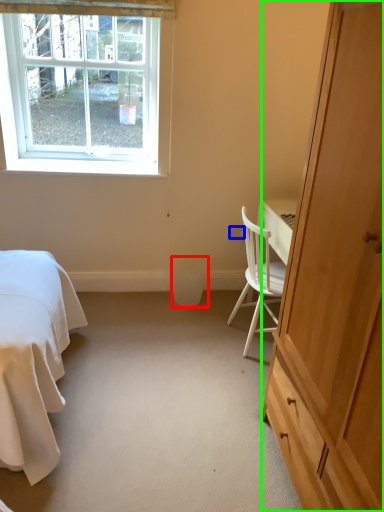
Question: Considering the real-world distances, which object is closest to trash bin/can (highlighted by a red box)? power outlet (highlighted by a blue box) or cabinetry (highlighted by a green box).

Choices:
 (A) power outlet
 (B) cabinetry

Answer: (A)